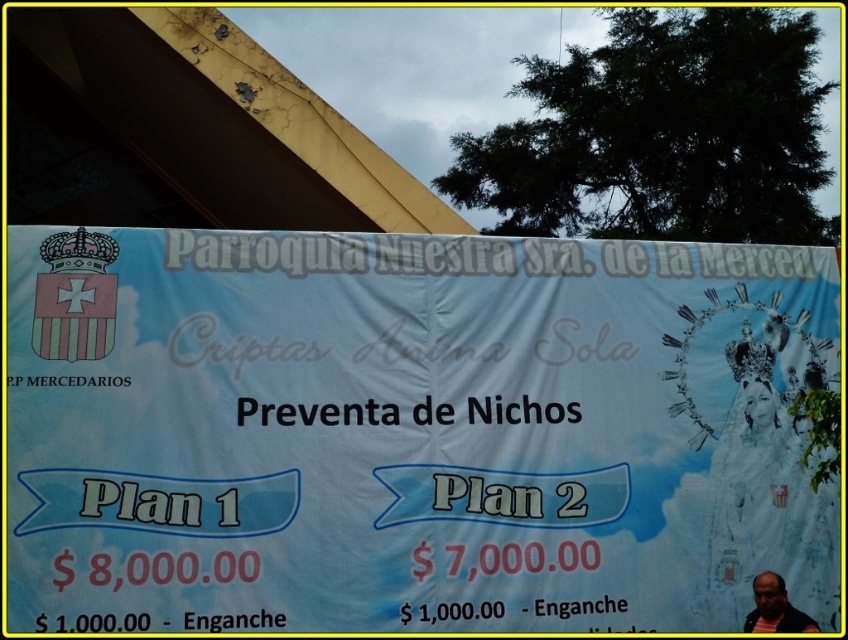
Question: Among these points, which one is farthest from the camera?

Choices:
 (A) (577, 618)
 (B) (780, 627)

Answer: (A)

Question: From the image, what is the correct spatial relationship of white paper banner at center in relation to striped shirt at lower right?

Choices:
 (A) left
 (B) right

Answer: (A)

Question: Which of the following is the closest to the observer?

Choices:
 (A) (600, 586)
 (B) (749, 624)

Answer: (A)

Question: From the image, what is the correct spatial relationship of white paper banner at center in relation to striped shirt at lower right?

Choices:
 (A) right
 (B) left

Answer: (B)

Question: Is white paper banner at center wider than striped shirt at lower right?

Choices:
 (A) yes
 (B) no

Answer: (A)